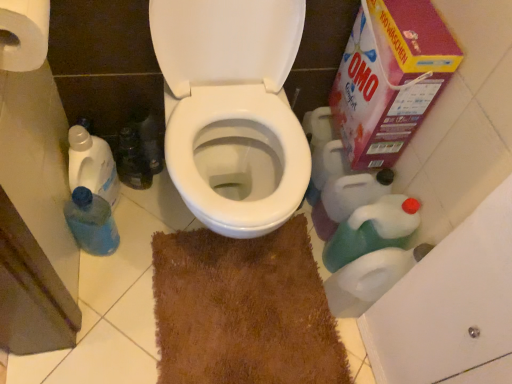
Question: From the image's perspective, is cardboard box at upper right positioned above or below brown shaggy rug at center?

Choices:
 (A) above
 (B) below

Answer: (A)

Question: In the image, is cardboard box at upper right positioned in front of or behind brown shaggy rug at center?

Choices:
 (A) front
 (B) behind

Answer: (A)

Question: Which object is the farthest from the white paper towel at upper left?

Choices:
 (A) green plastic bottle at lower right, which ranks as the second cleaning product in left-to-right order
 (B) blue plastic bottle at left, the 2th cleaning product from the right
 (C) brown shaggy rug at center
 (D) cardboard box at upper right
 (E) blue translucent bottle at lower left

Answer: (A)

Question: Which is farther from the blue translucent bottle at lower left?

Choices:
 (A) white paper towel at upper left
 (B) blue plastic bottle at left, the first cleaning product from the left
 (C) cardboard box at upper right
 (D) green plastic bottle at lower right, which ranks as the second cleaning product in left-to-right order
 (E) brown shaggy rug at center

Answer: (C)